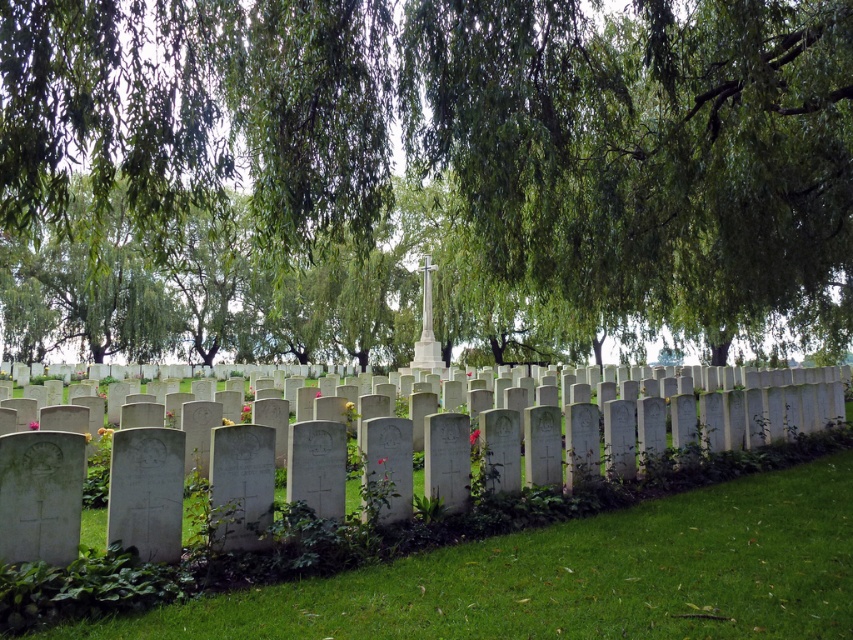
You are standing at the edge of the cemetery and notice both the green leafy tree at center and the green grass at lower center. Which object appears wider from your perspective?

The green leafy tree at center appears wider than the green grass at lower center because its width is larger according to the description.

You are standing at the entrance of the cemetery and see the point marked as point (422, 173). What is located at this point?

The point (422, 173) marks the location of the green leafy tree at center.